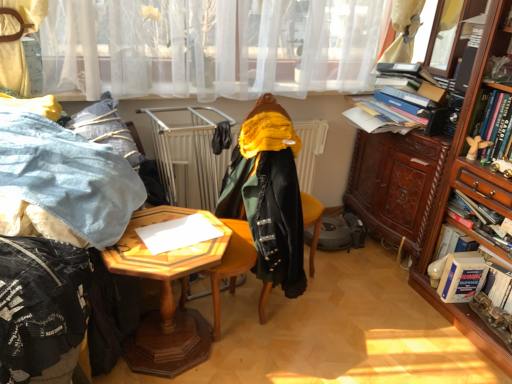
Locate an element on the screen. This screenshot has height=384, width=512. free space above wooden hexagonal table at center (from a real-world perspective) is located at coordinates 170,234.